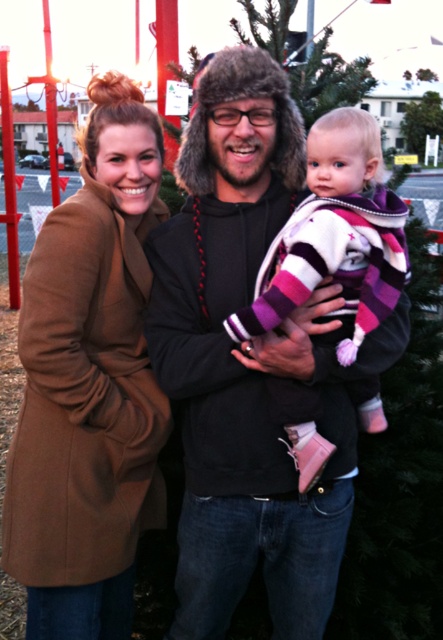
Question: Is brown wool coat at center positioned behind green textured christmas tree at center?

Choices:
 (A) no
 (B) yes

Answer: (B)

Question: Among these objects, which one is nearest to the camera?

Choices:
 (A) brown wool coat at center
 (B) pink striped sweater at center
 (C) green textured christmas tree at center

Answer: (B)

Question: Is green textured christmas tree at center above pink striped sweater at center?

Choices:
 (A) yes
 (B) no

Answer: (B)

Question: Which object is farther from the camera taking this photo?

Choices:
 (A) green textured christmas tree at center
 (B) brown wool coat at center
 (C) pink striped sweater at center

Answer: (B)

Question: Which object appears farthest from the camera in this image?

Choices:
 (A) pink striped sweater at center
 (B) green textured christmas tree at center
 (C) brown wool coat at center

Answer: (C)

Question: From the image, what is the correct spatial relationship of brown wool coat at center in relation to green textured christmas tree at center?

Choices:
 (A) above
 (B) below

Answer: (B)